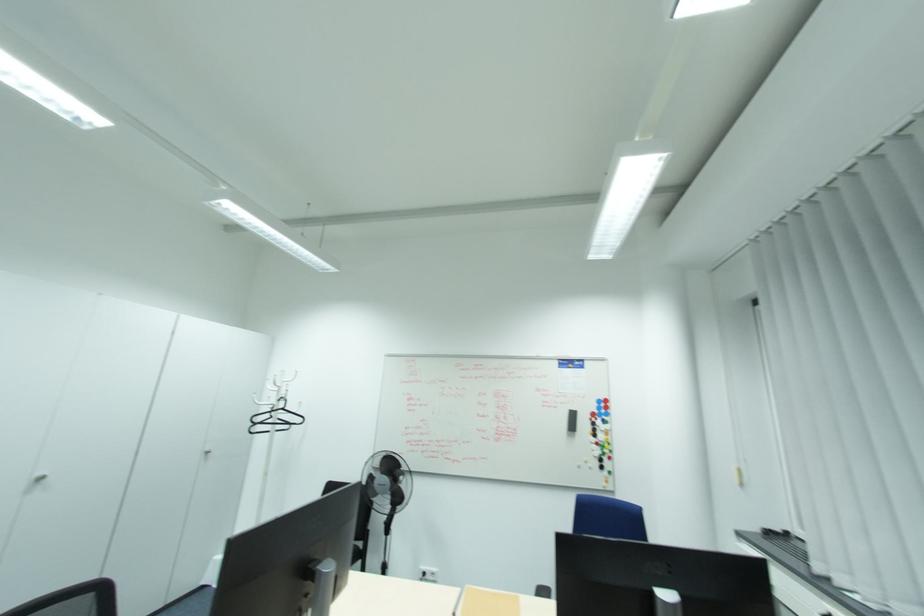
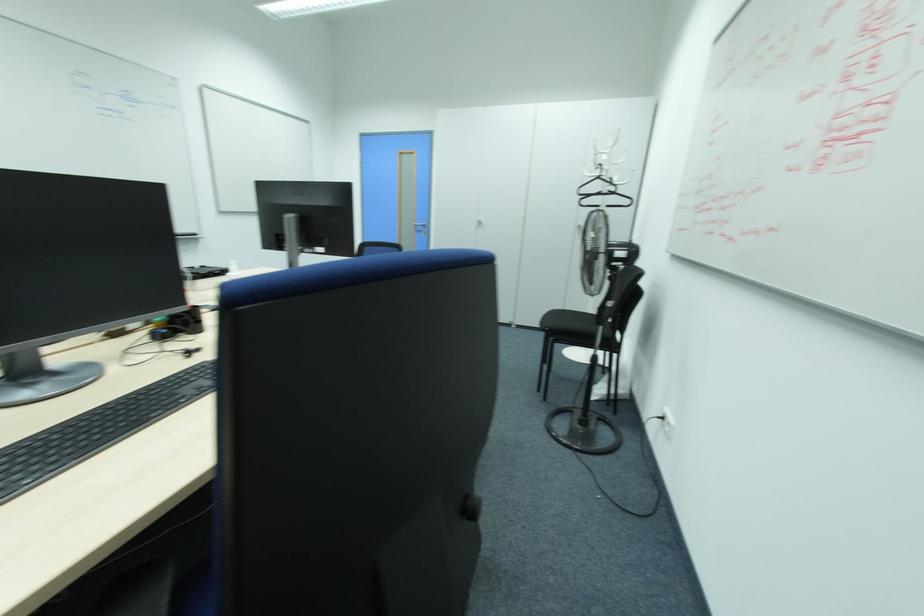
In the second image, find the point that corresponds to (284,408) in the first image.

(599, 177)